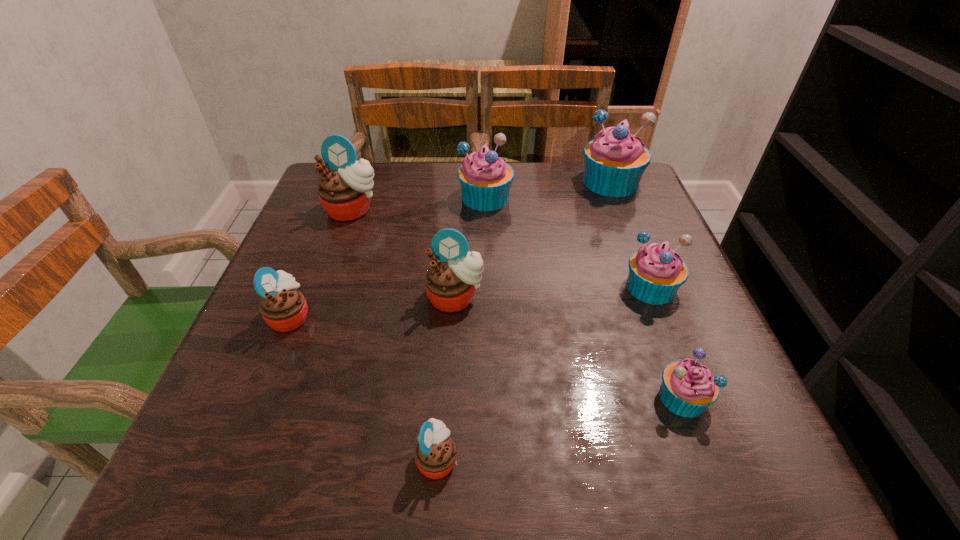
This screenshot has height=540, width=960. Identify the location of empty space between the second nearest muffin and the third smallest blue muffin. (584, 297).

Where is `the seventh closest object to the leftmost blue muffin`? The height and width of the screenshot is (540, 960). the seventh closest object to the leftmost blue muffin is located at coordinates (435, 455).

Find the location of a particular element. The width and height of the screenshot is (960, 540). object that is the second closest to the third smallest pink muffin is located at coordinates (485, 178).

This screenshot has height=540, width=960. What are the coordinates of `muffin that stands as the fourth closest to the second nearest blue muffin` in the screenshot? It's located at (485, 178).

Identify which muffin is the fourth closest to the biggest blue muffin. Please provide its 2D coordinates. Your answer should be formatted as a tuple, i.e. [(x, y)], where the tuple contains the x and y coordinates of a point satisfying the conditions above.

[(344, 192)]

Where is `the third closest blue muffin relative to the biggest blue muffin`? The width and height of the screenshot is (960, 540). the third closest blue muffin relative to the biggest blue muffin is located at coordinates (688, 388).

The height and width of the screenshot is (540, 960). What are the coordinates of `blue muffin object that ranks as the second closest to the second biggest blue muffin` in the screenshot? It's located at (656, 272).

Locate which pink muffin ranks third in proximity to the third smallest pink muffin. Please provide its 2D coordinates. Your answer should be formatted as a tuple, i.e. [(x, y)], where the tuple contains the x and y coordinates of a point satisfying the conditions above.

[(435, 455)]

The width and height of the screenshot is (960, 540). Find the location of `pink muffin object that ranks as the closest to the third biggest pink muffin`. pink muffin object that ranks as the closest to the third biggest pink muffin is located at coordinates (451, 281).

Image resolution: width=960 pixels, height=540 pixels. I want to click on vacant area in the image that satisfies the following two spatial constraints: 1. on the front side of the biggest blue muffin; 2. on the front-facing side of the third biggest pink muffin, so click(x=663, y=316).